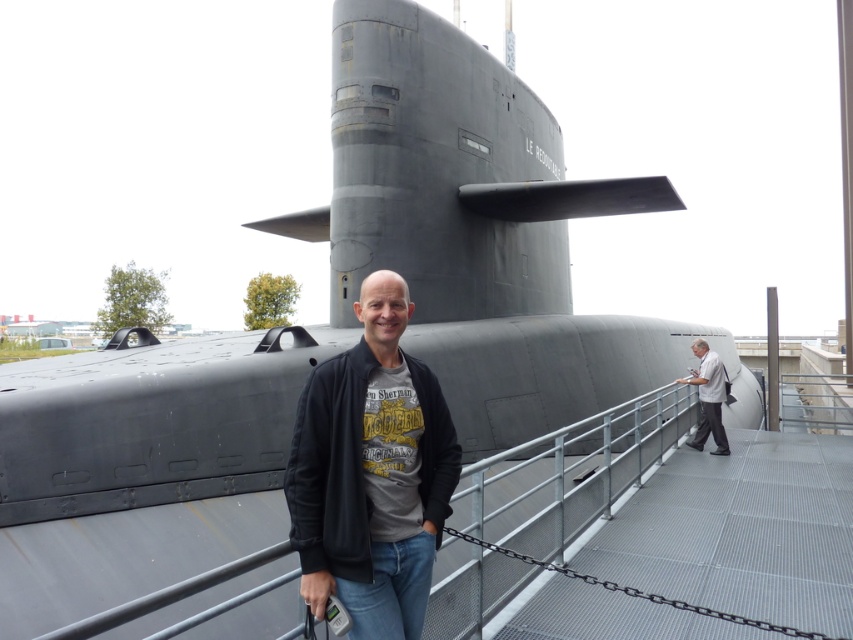
Is point (308, 600) farther from camera compared to point (701, 356)?

No, it is not.

Which is more to the right, black matte jacket at center or gray matte jacket at right?

From the viewer's perspective, gray matte jacket at right appears more on the right side.

Find the location of `black matte jacket at center`. black matte jacket at center is located at coordinates (370, 472).